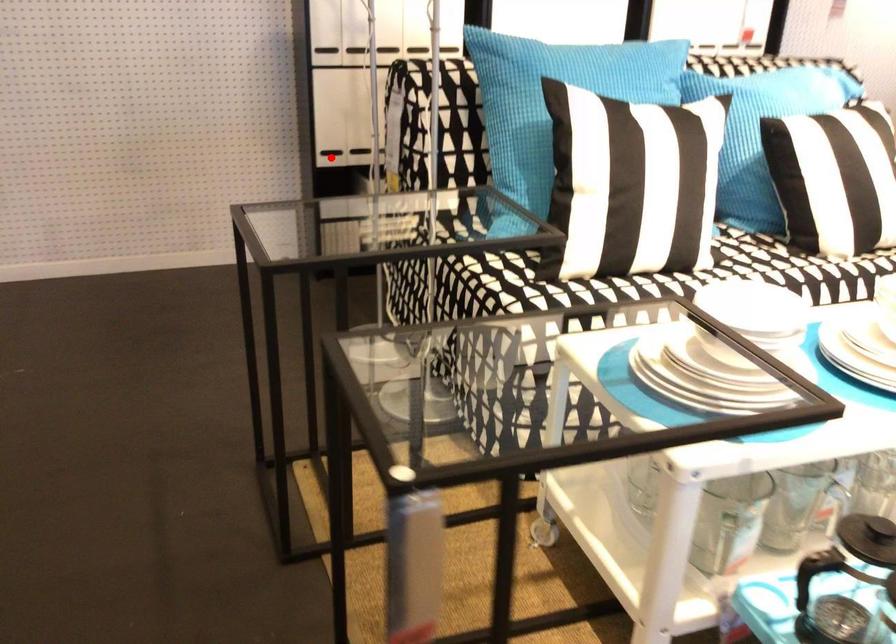
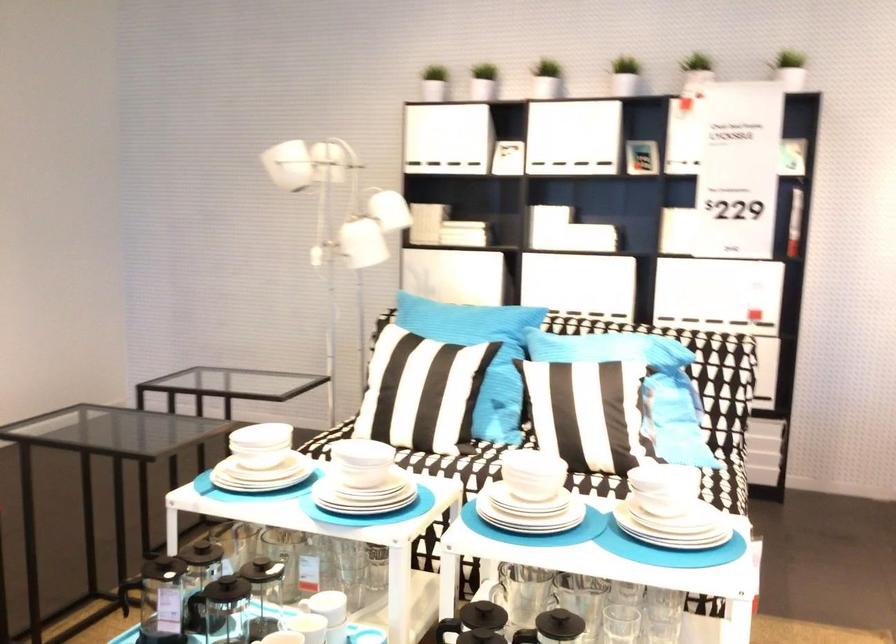
Question: I am providing you with two images of the same scene from different viewpoints. A red point is marked on the first image. At the location where the point appears in image 1, is it still visible in image 2?

Choices:
 (A) Yes
 (B) No

Answer: (B)